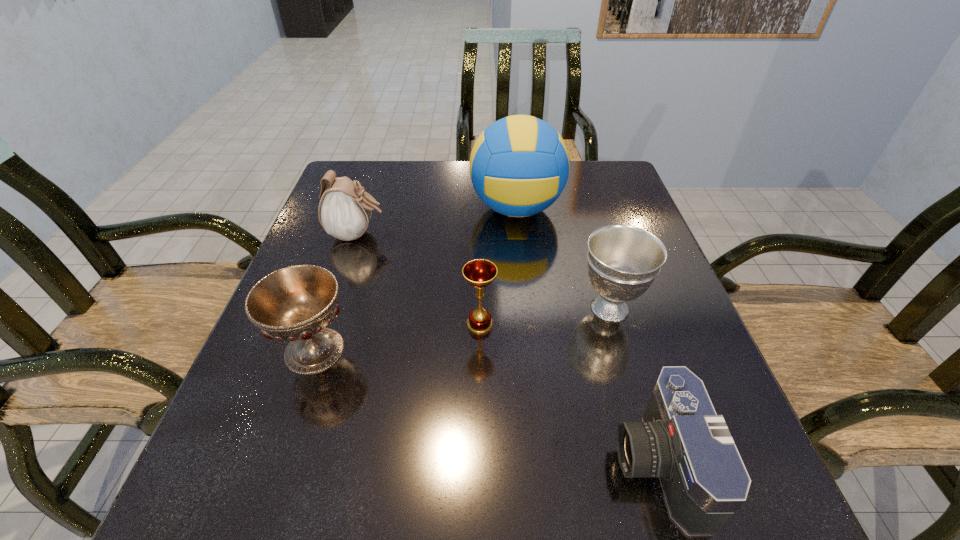
The width and height of the screenshot is (960, 540). What are the coordinates of `vacant space located 0.220m on the right of the leftmost chalice` in the screenshot? It's located at (471, 350).

Where is `free point located on the back of the second chalice from right to left`? This screenshot has height=540, width=960. free point located on the back of the second chalice from right to left is located at coordinates (480, 230).

The image size is (960, 540). Identify the location of free spot located on the front-facing side of the camera. (388, 463).

This screenshot has width=960, height=540. What are the coordinates of `vacant space situated on the front-facing side of the camera` in the screenshot? It's located at (407, 463).

Where is `free space located on the front-facing side of the camera`? free space located on the front-facing side of the camera is located at coordinates (440, 463).

At what (x,y) coordinates should I click in order to perform the action: click on object that is positioned at the far edge. Please return your answer as a coordinate pair (x, y). Image resolution: width=960 pixels, height=540 pixels. Looking at the image, I should click on (519, 165).

Identify the location of object located in the near edge section of the desktop. Image resolution: width=960 pixels, height=540 pixels. (682, 440).

Where is `pouch that is at the left edge`? The image size is (960, 540). pouch that is at the left edge is located at coordinates (344, 211).

Where is `chalice situated at the left edge`? chalice situated at the left edge is located at coordinates (296, 303).

The width and height of the screenshot is (960, 540). Identify the location of chalice located in the right edge section of the desktop. (623, 261).